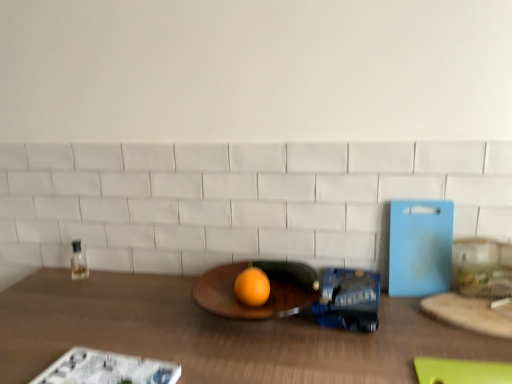
This screenshot has height=384, width=512. Describe the element at coordinates (470, 313) in the screenshot. I see `wooden cutting board at right` at that location.

Locate an element on the screen. wooden table at center is located at coordinates (215, 334).

Find the location of `orange matte grapefruit at center`. orange matte grapefruit at center is located at coordinates (252, 287).

Identify the location of wooden cutting board at right. This screenshot has width=512, height=384. pyautogui.click(x=470, y=313).

Is clear glass bottle at left not close to orange matte grapefruit at center?

That's not correct — clear glass bottle at left is a little close to orange matte grapefruit at center.

Locate an element on the screen. The width and height of the screenshot is (512, 384). grapefruit on the right of the clear glass bottle at left is located at coordinates (252, 287).

Relative to orange matte grapefruit at center, is clear glass bottle at left in front or behind?

clear glass bottle at left is behind orange matte grapefruit at center.

Between clear glass bottle at left and orange matte grapefruit at center, which one has smaller width?

Thinner between the two is clear glass bottle at left.

In the image, there is a wooden cutting board at right. At what (x,y) coordinates should I click in order to perform the action: click on table below it (from the image's perspective). Please return your answer as a coordinate pair (x, y). Looking at the image, I should click on 215,334.

Can you confirm if wooden cutting board at right is bigger than wooden table at center?

No.

Considering the sizes of objects wooden cutting board at right and wooden table at center in the image provided, who is thinner, wooden cutting board at right or wooden table at center?

wooden cutting board at right.

How much distance is there between wooden table at center and orange matte grapefruit at center?

They are 10.23 inches apart.

Can you confirm if wooden table at center is bigger than orange matte grapefruit at center?

Correct, wooden table at center is larger in size than orange matte grapefruit at center.

Would you say wooden table at center is to the left or to the right of orange matte grapefruit at center in the picture?

From the image, it's evident that wooden table at center is to the left of orange matte grapefruit at center.

Where is `grapefruit behind the wooden table at center`? grapefruit behind the wooden table at center is located at coordinates (252, 287).

Does clear glass bottle at left turn towards wooden table at center?

No, clear glass bottle at left is not turned towards wooden table at center.

How many degrees apart are the facing directions of clear glass bottle at left and wooden table at center?

The facing directions of clear glass bottle at left and wooden table at center are 4.1 degrees apart.

From the image's perspective, is clear glass bottle at left located above wooden table at center?

Yes.

Is clear glass bottle at left next to wooden table at center?

clear glass bottle at left and wooden table at center are clearly separated.

Locate an element on the screen. This screenshot has width=512, height=384. grapefruit located above the wooden table at center (from a real-world perspective) is located at coordinates (252, 287).

In terms of size, does orange matte grapefruit at center appear bigger or smaller than wooden table at center?

Considering their sizes, orange matte grapefruit at center takes up less space than wooden table at center.

Is orange matte grapefruit at center facing towards wooden table at center?

No, orange matte grapefruit at center is not turned towards wooden table at center.

From the picture: Is orange matte grapefruit at center wider than clear glass bottle at left?

Yes, orange matte grapefruit at center is wider than clear glass bottle at left.

Is orange matte grapefruit at center oriented away from clear glass bottle at left?

No.

Which is in front, point (257, 282) or point (73, 274)?

Positioned in front is point (257, 282).

Find the location of a particular element. bottle behind the orange matte grapefruit at center is located at coordinates (78, 261).

How distant is wooden cutting board at right from clear glass bottle at left?

wooden cutting board at right and clear glass bottle at left are 38.79 inches apart from each other.

Can you confirm if wooden cutting board at right is bigger than clear glass bottle at left?

Yes.

Consider the image. Is wooden cutting board at right not near clear glass bottle at left?

No, wooden cutting board at right is not far from clear glass bottle at left.

Find the location of `bottle located underneath the orange matte grapefruit at center (from a real-world perspective)`. bottle located underneath the orange matte grapefruit at center (from a real-world perspective) is located at coordinates (78, 261).

Where is `table lying on the left of wooden cutting board at right`? This screenshot has width=512, height=384. table lying on the left of wooden cutting board at right is located at coordinates (215, 334).

From the image, which object appears to be nearer to orange matte grapefruit at center, clear glass bottle at left or wooden cutting board at right?

wooden cutting board at right is positioned closer to the anchor orange matte grapefruit at center.

When comparing their distances from wooden table at center, does orange matte grapefruit at center or wooden cutting board at right seem further?

wooden cutting board at right.

From the image, which object appears to be nearer to orange matte grapefruit at center, clear glass bottle at left or wooden table at center?

wooden table at center lies closer to orange matte grapefruit at center than the other object.

Estimate the real-world distances between objects in this image. Which object is further from wooden cutting board at right, orange matte grapefruit at center or clear glass bottle at left?

clear glass bottle at left is further to wooden cutting board at right.

When comparing their distances from orange matte grapefruit at center, does wooden cutting board at right or wooden table at center seem further?

wooden cutting board at right is further to orange matte grapefruit at center.

Estimate the real-world distances between objects in this image. Which object is closer to orange matte grapefruit at center, wooden cutting board at right or clear glass bottle at left?

wooden cutting board at right is closer to orange matte grapefruit at center.

Looking at the image, which one is located further to clear glass bottle at left, wooden cutting board at right or wooden table at center?

wooden cutting board at right lies further to clear glass bottle at left than the other object.

Looking at the image, which one is located closer to clear glass bottle at left, wooden cutting board at right or orange matte grapefruit at center?

orange matte grapefruit at center.

The height and width of the screenshot is (384, 512). I want to click on grapefruit situated between clear glass bottle at left and wooden cutting board at right from left to right, so click(x=252, y=287).

The image size is (512, 384). In order to click on grapefruit between wooden table at center and wooden cutting board at right in this screenshot , I will do `click(252, 287)`.

The height and width of the screenshot is (384, 512). Find the location of `table between clear glass bottle at left and wooden cutting board at right from left to right`. table between clear glass bottle at left and wooden cutting board at right from left to right is located at coordinates (215, 334).

What are the coordinates of `grapefruit between wooden table at center and clear glass bottle at left along the z-axis` in the screenshot? It's located at (252, 287).